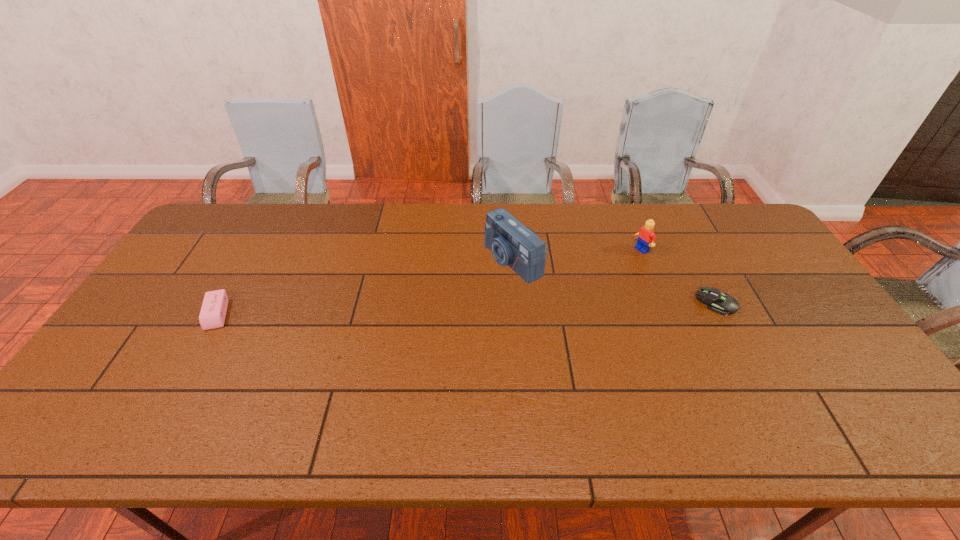
Where is `free space on the desktop that is between the eraser and the rightmost object and is positioned on the lens of the camera`? This screenshot has height=540, width=960. free space on the desktop that is between the eraser and the rightmost object and is positioned on the lens of the camera is located at coordinates pos(403,310).

You are a GUI agent. You are given a task and a screenshot of the screen. Output one action in this format:
    pyautogui.click(x=<x>, y=<y>)
    Task: Click on the free space on the desktop that is between the leftmost object and the shortest object and is positioned on the face of the Lego
    Image resolution: width=960 pixels, height=540 pixels.
    Given the screenshot: What is the action you would take?
    pyautogui.click(x=527, y=307)